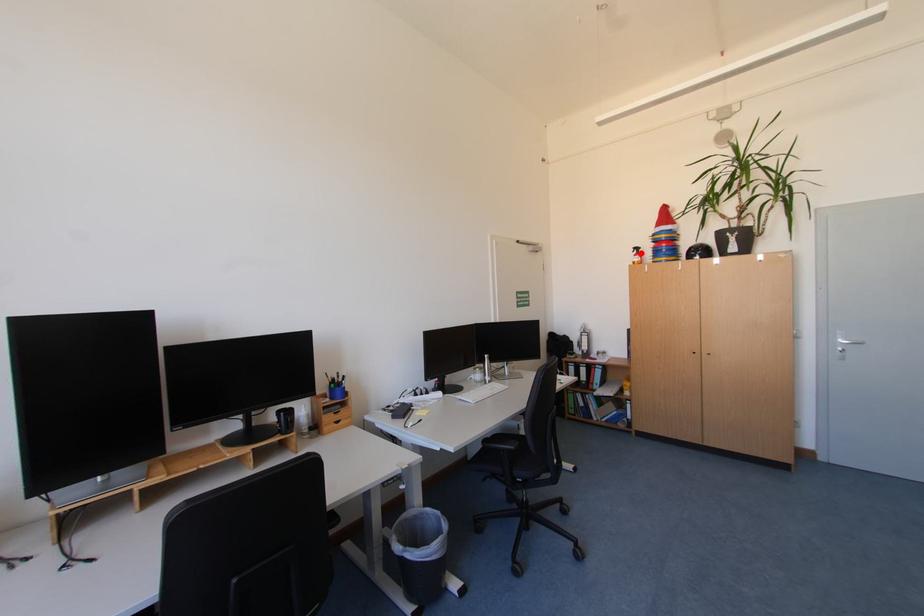
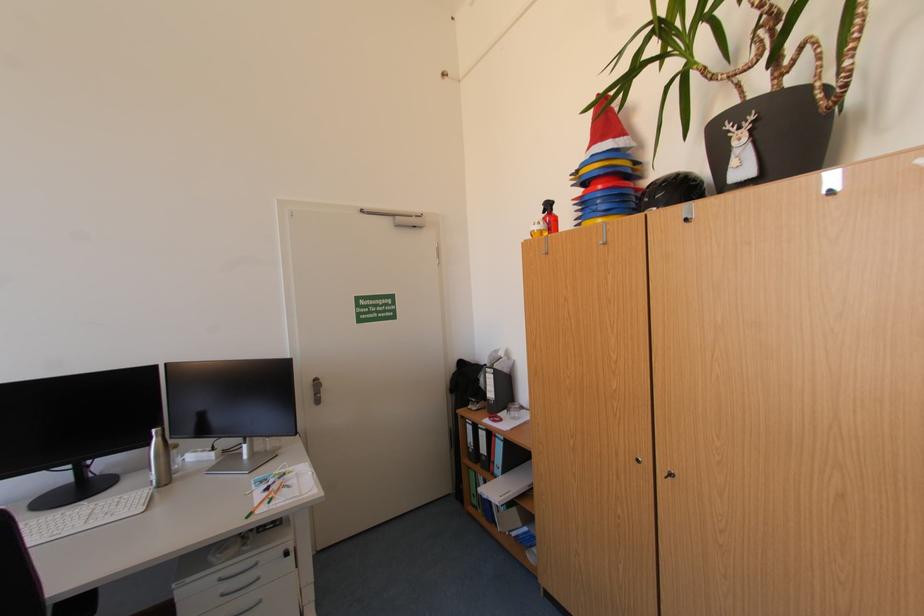
Find the pixel in the second image that matches the highlighted location in the first image.

(552, 213)